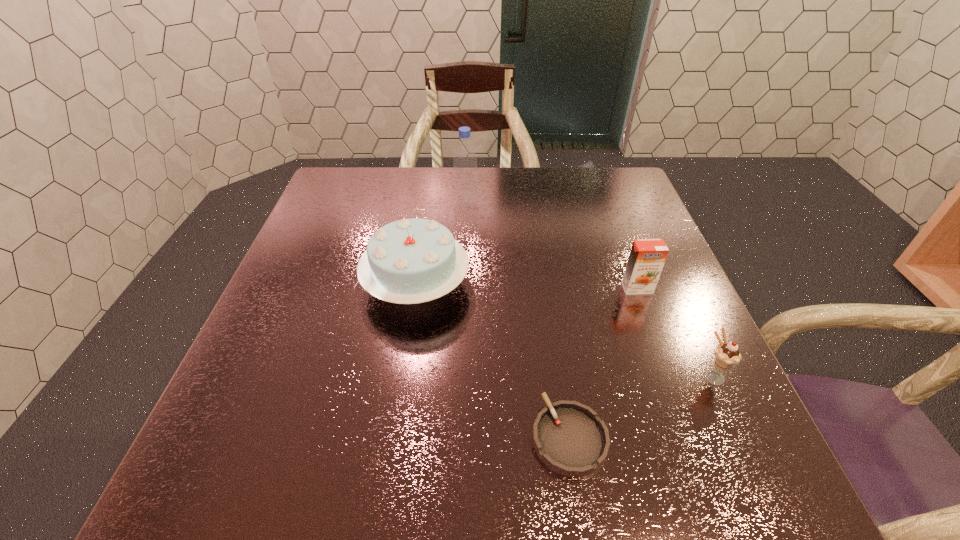
Locate an element on the screen. blank space that satisfies the following two spatial constraints: 1. on the front side of the orange juice; 2. on the left side of the farthest object is located at coordinates (463, 288).